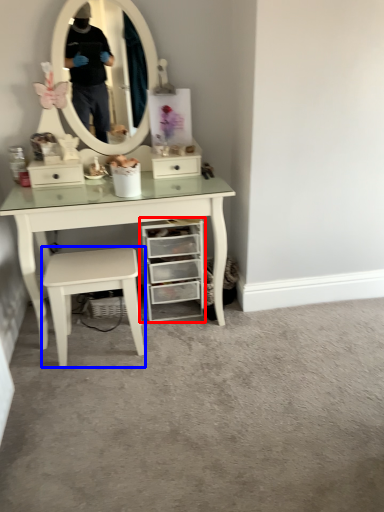
Question: Among these objects, which one is farthest to the camera, chest of drawers (highlighted by a red box) or stool (highlighted by a blue box)?

Choices:
 (A) chest of drawers
 (B) stool

Answer: (A)